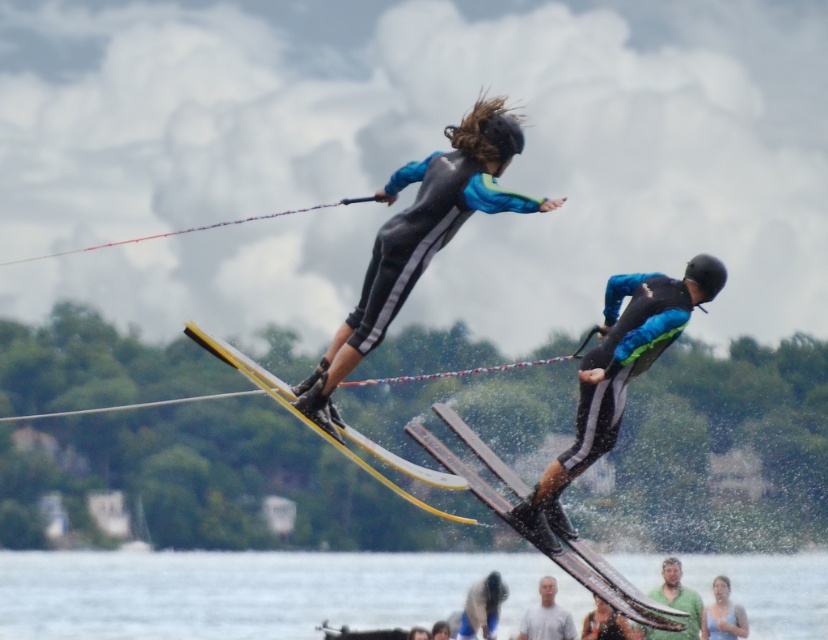
Can you confirm if metallic silver skis at center is shorter than light blue fabric shirt at lower center?

Incorrect, metallic silver skis at center's height does not fall short of light blue fabric shirt at lower center's.

Is point (682, 612) more distant than point (705, 609)?

No, (682, 612) is in front of (705, 609).

You are a GUI agent. You are given a task and a screenshot of the screen. Output one action in this format:
    pyautogui.click(x=<x>, y=<y>)
    Task: Click on the metallic silver skis at center
    The image size is (828, 640).
    Given the screenshot: What is the action you would take?
    pyautogui.click(x=614, y=588)

Does clear water at lower center appear on the right side of metallic silver skis at center?

In fact, clear water at lower center is to the left of metallic silver skis at center.

Does clear water at lower center have a larger size compared to metallic silver skis at center?

Incorrect, clear water at lower center is not larger than metallic silver skis at center.

Who is more distant from viewer, (27, 624) or (593, 577)?

The point (27, 624) is more distant.

Identify the location of clear water at lower center. The height and width of the screenshot is (640, 828). (254, 592).

Which is above, matte black water skis at center or metallic silver skis at center?

matte black water skis at center

Can you confirm if matte black water skis at center is taller than metallic silver skis at center?

Yes, matte black water skis at center is taller than metallic silver skis at center.

Is point (692, 282) closer to camera compared to point (593, 577)?

Yes, it is.

Where is `matte black water skis at center`? matte black water skis at center is located at coordinates (614, 380).